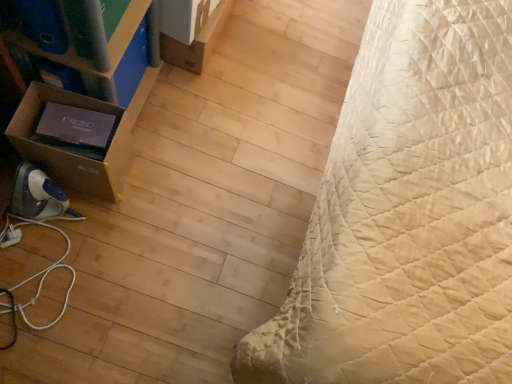
Question: Is brown cardboard box at left, placed as the second cardboard box when sorted from back to front, taller than matte cardboard box at left?

Choices:
 (A) yes
 (B) no

Answer: (B)

Question: Is matte cardboard box at left a part of brown cardboard box at left, which appears as the 1th cardboard box when viewed from the left?

Choices:
 (A) no
 (B) yes

Answer: (A)

Question: Can you confirm if brown cardboard box at left, placed as the 1th cardboard box when sorted from front to back, is positioned to the left of matte cardboard box at left?

Choices:
 (A) no
 (B) yes

Answer: (B)

Question: Can we say brown cardboard box at left, arranged as the second cardboard box when viewed from the right, lies outside matte cardboard box at left?

Choices:
 (A) no
 (B) yes

Answer: (B)

Question: From the image's perspective, does brown cardboard box at left, arranged as the 1th cardboard box when ordered from the bottom, appear higher than matte cardboard box at left?

Choices:
 (A) no
 (B) yes

Answer: (A)

Question: From a real-world perspective, is brown cardboard box at left, arranged as the second cardboard box when viewed from the right, located beneath matte cardboard box at left?

Choices:
 (A) no
 (B) yes

Answer: (B)

Question: Is matte cardboard box at left next to brown cardboard box at left, arranged as the second cardboard box when viewed from the right?

Choices:
 (A) yes
 (B) no

Answer: (A)

Question: From the image's perspective, is matte cardboard box at left on brown cardboard box at left, placed as the 1th cardboard box when sorted from front to back?

Choices:
 (A) yes
 (B) no

Answer: (A)

Question: Is matte cardboard box at left further to the viewer compared to brown cardboard box at left, which appears as the 1th cardboard box when viewed from the left?

Choices:
 (A) yes
 (B) no

Answer: (B)

Question: Is matte cardboard box at left oriented towards brown cardboard box at left, placed as the second cardboard box when sorted from back to front?

Choices:
 (A) no
 (B) yes

Answer: (A)

Question: Is brown cardboard box at left, arranged as the 1th cardboard box when ordered from the bottom, inside matte cardboard box at left?

Choices:
 (A) yes
 (B) no

Answer: (B)

Question: Is matte cardboard box at left thinner than brown cardboard box at left, arranged as the 1th cardboard box when ordered from the bottom?

Choices:
 (A) yes
 (B) no

Answer: (B)

Question: Does beige quilted bed at right have a larger size compared to matte cardboard box at left?

Choices:
 (A) yes
 (B) no

Answer: (A)